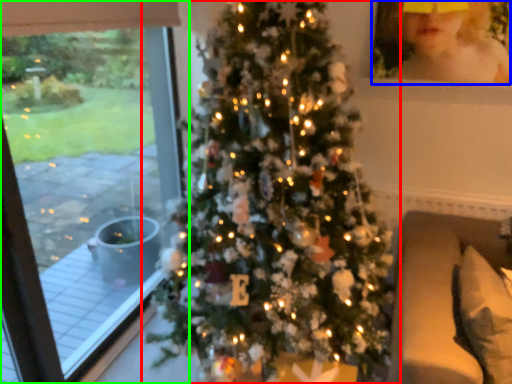
Question: Which is nearer to the christmas tree (highlighted by a red box)? toddler (highlighted by a blue box) or window (highlighted by a green box).

Choices:
 (A) toddler
 (B) window

Answer: (A)